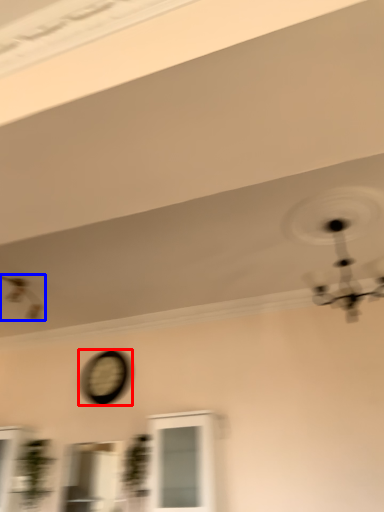
Question: Which point is closer to the camera, clock (highlighted by a red box) or mechanical fan (highlighted by a blue box)?

Choices:
 (A) clock
 (B) mechanical fan

Answer: (B)